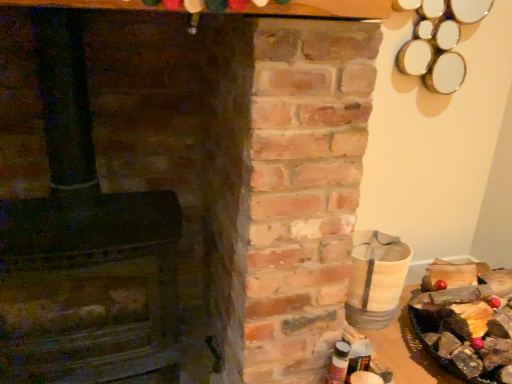
Question: From the image's perspective, is wooden log at right below rustic brick fireplace at left?

Choices:
 (A) no
 (B) yes

Answer: (B)

Question: Is wooden log at right aimed at rustic brick fireplace at left?

Choices:
 (A) no
 (B) yes

Answer: (A)

Question: Is wooden log at right thinner than rustic brick fireplace at left?

Choices:
 (A) yes
 (B) no

Answer: (B)

Question: Considering the relative sizes of wooden log at right and rustic brick fireplace at left in the image provided, is wooden log at right wider than rustic brick fireplace at left?

Choices:
 (A) yes
 (B) no

Answer: (A)

Question: Does wooden log at right appear on the right side of rustic brick fireplace at left?

Choices:
 (A) yes
 (B) no

Answer: (A)

Question: Is wooden log at right far away from rustic brick fireplace at left?

Choices:
 (A) yes
 (B) no

Answer: (A)

Question: Is rustic brick fireplace at left to the right of wooden log at right from the viewer's perspective?

Choices:
 (A) no
 (B) yes

Answer: (A)

Question: From the image's perspective, is rustic brick fireplace at left beneath wooden log at right?

Choices:
 (A) no
 (B) yes

Answer: (A)

Question: Can you confirm if rustic brick fireplace at left is taller than wooden log at right?

Choices:
 (A) no
 (B) yes

Answer: (B)

Question: Does rustic brick fireplace at left have a greater width compared to wooden log at right?

Choices:
 (A) no
 (B) yes

Answer: (A)

Question: Is rustic brick fireplace at left positioned beyond the bounds of wooden log at right?

Choices:
 (A) no
 (B) yes

Answer: (B)

Question: From the image's perspective, is rustic brick fireplace at left on wooden log at right?

Choices:
 (A) no
 (B) yes

Answer: (B)

Question: Which is correct: rustic brick fireplace at left is inside wooden log at right, or outside of it?

Choices:
 (A) outside
 (B) inside

Answer: (A)